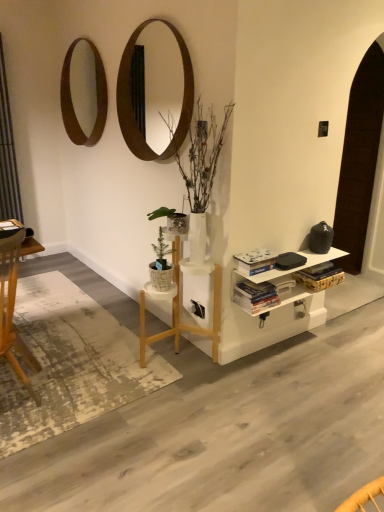
The height and width of the screenshot is (512, 384). Find the location of `free space underneath hardcover books at center, the second book positioned from the top (from a real-world perspective)`. free space underneath hardcover books at center, the second book positioned from the top (from a real-world perspective) is located at coordinates (258, 297).